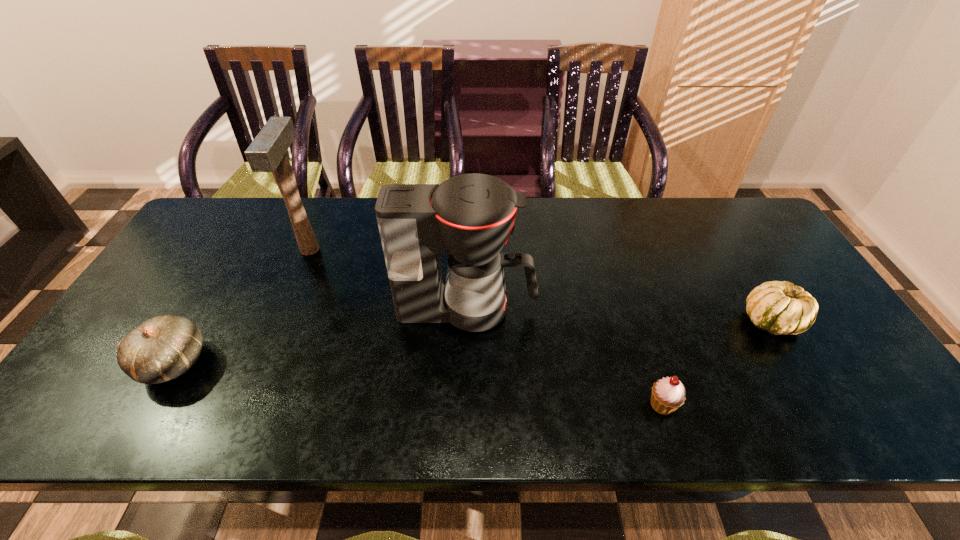
Image resolution: width=960 pixels, height=540 pixels. What are the coordinates of `object that is the closest to the coffee maker` in the screenshot? It's located at (668, 394).

Where is `free space that satisfies the following two spatial constraints: 1. pour from the carafe of the rightmost object; 2. on the right side of the coffee maker`? The height and width of the screenshot is (540, 960). free space that satisfies the following two spatial constraints: 1. pour from the carafe of the rightmost object; 2. on the right side of the coffee maker is located at coordinates (468, 321).

At what (x,y) coordinates should I click in order to perform the action: click on vacant area that satisfies the following two spatial constraints: 1. pour from the carafe of the coffee maker; 2. on the back side of the cupcake. Please return your answer as a coordinate pair (x, y). This screenshot has height=540, width=960. Looking at the image, I should click on (466, 404).

You are a GUI agent. You are given a task and a screenshot of the screen. Output one action in this format:
    pyautogui.click(x=<x>, y=<y>)
    Task: Click on the vacant space that satisfies the following two spatial constraints: 1. on the back side of the left gourd; 2. on the left side of the second object from left to right
    
    Given the screenshot: What is the action you would take?
    (x=239, y=250)

At what (x,y) coordinates should I click in order to perform the action: click on blank area in the image that satisfies the following two spatial constraints: 1. on the front side of the leftmost object; 2. on the left side of the shortest object. Please return your answer as a coordinate pair (x, y). Image resolution: width=960 pixels, height=540 pixels. Looking at the image, I should click on (149, 404).